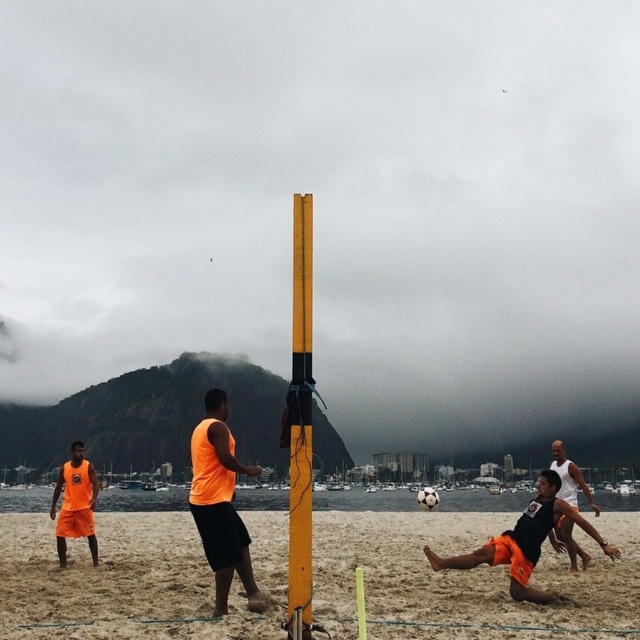
Between yellow painted wood pole at center and orange fabric shirt at center, which one appears on the right side from the viewer's perspective?

Positioned to the right is yellow painted wood pole at center.

Can you confirm if yellow painted wood pole at center is thinner than orange fabric shirt at center?

No.

Is point (304, 472) positioned after point (259, 470)?

No, (304, 472) is closer to viewer.

Identify the location of yellow painted wood pole at center. pyautogui.click(x=300, y=424).

Can you confirm if orange fabric shirt at center is positioned below white matte volleyball at center?

No.

What do you see at coordinates (220, 502) in the screenshot? Image resolution: width=640 pixels, height=640 pixels. I see `orange fabric shirt at center` at bounding box center [220, 502].

The image size is (640, 640). In order to click on orange fabric shirt at center in this screenshot , I will do `click(220, 502)`.

Is point (291, 332) less distant than point (556, 483)?

That is False.

Which is more to the left, yellow painted wood pole at center or black matte soccer player at center?

Positioned to the left is yellow painted wood pole at center.

The height and width of the screenshot is (640, 640). I want to click on yellow painted wood pole at center, so click(x=300, y=424).